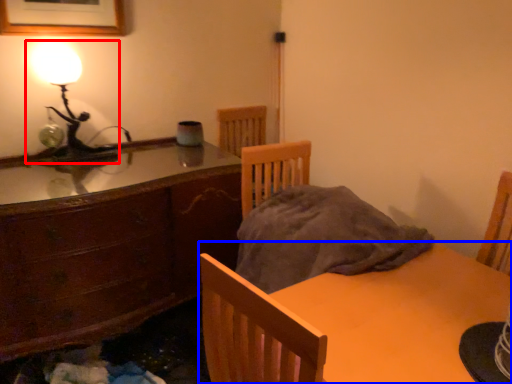
Question: Among these objects, which one is farthest to the camera, lamp (highlighted by a red box) or table (highlighted by a blue box)?

Choices:
 (A) lamp
 (B) table

Answer: (A)